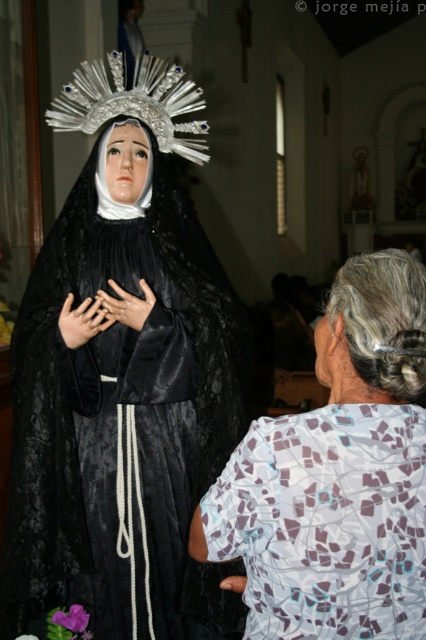
You are standing in the church and want to place a 1 meter long decorative banner between the matte black statue at center and the printed fabric blouse at lower right. Will the banner fit between them?

The distance between the matte black statue at center and the printed fabric blouse at lower right is 85.48 centimeters. Since the banner is 1 meter long, which is longer than the available space, it will not fit between them.

You are a photographer standing in the church and want to capture both the matte black statue at center and the printed fabric blouse at lower right in a single frame. Which object should you focus on first if you want to ensure both are in focus, considering their sizes?

The matte black statue at center is taller than the printed fabric blouse at lower right, so focusing on the statue first would help ensure both are in focus as it is the larger subject.

You are an interior designer assessing the space for a new sculpture. The matte black statue at center and the printed fabric blouse at lower right are currently in the room. Which object would require a larger display area due to its size?

The matte black statue at center requires a larger display area because it is larger in size compared to the printed fabric blouse at lower right.